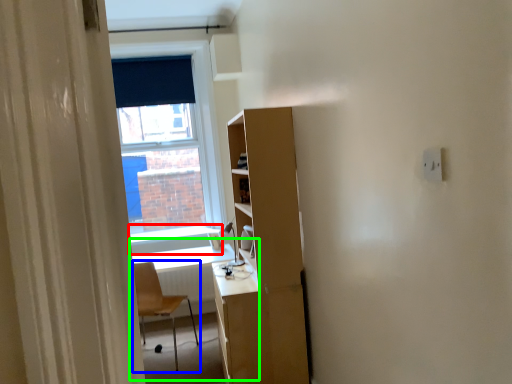
Question: Which object is positioned closest to window sill (highlighted by a red box)? Select from chair (highlighted by a blue box) and computer desk (highlighted by a green box).

Choices:
 (A) chair
 (B) computer desk

Answer: (B)